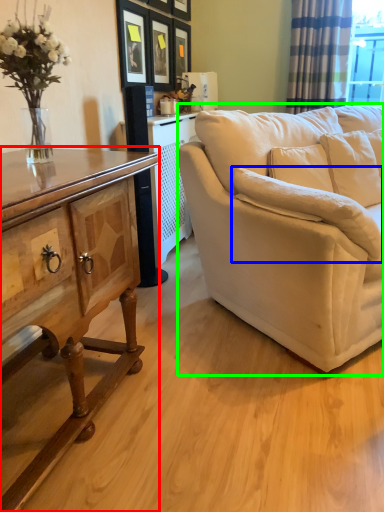
Question: Considering the real-world distances, which object is farthest from cabinetry (highlighted by a red box)? pillow (highlighted by a blue box) or studio couch (highlighted by a green box)?

Choices:
 (A) pillow
 (B) studio couch

Answer: (B)